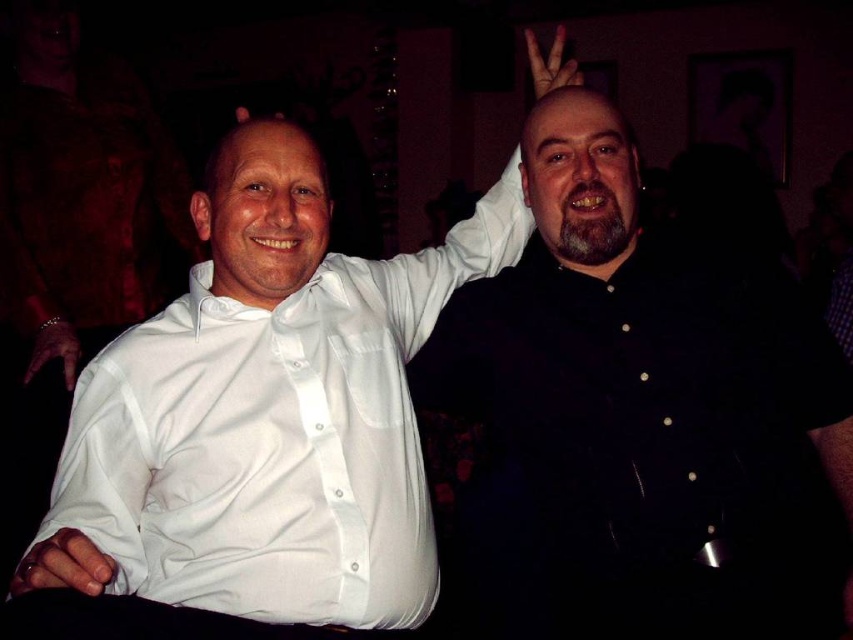
Question: Which is farther from the metallic bracelet at lower left?

Choices:
 (A) white shirt at upper right
 (B) matte white hand at lower left
 (C) black matte shirt at right

Answer: (C)

Question: From the image, what is the correct spatial relationship of white shirt at upper right in relation to white matte hand at upper center?

Choices:
 (A) right
 (B) left

Answer: (B)

Question: Is white smooth shirt at left further to the viewer compared to white shirt at upper right?

Choices:
 (A) yes
 (B) no

Answer: (B)

Question: Can you confirm if matte white hand at lower left is thinner than metallic bracelet at lower left?

Choices:
 (A) yes
 (B) no

Answer: (B)

Question: Among these objects, which one is nearest to the camera?

Choices:
 (A) black matte shirt at right
 (B) white glossy shirt at center
 (C) matte white hand at lower left

Answer: (C)

Question: Among these points, which one is farthest from the camera?

Choices:
 (A) (170, 560)
 (B) (73, 362)
 (C) (73, 451)
 (D) (721, 401)

Answer: (B)